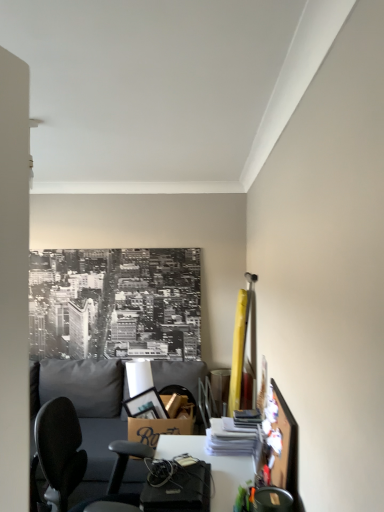
Question: Should I look upward or downward to see metallic gray chair at lower right?

Choices:
 (A) up
 (B) down

Answer: (B)

Question: From the image's perspective, is gray fabric couch at lower left located above white glossy desk at center?

Choices:
 (A) no
 (B) yes

Answer: (A)

Question: From the image's perspective, is gray fabric couch at lower left below white glossy desk at center?

Choices:
 (A) yes
 (B) no

Answer: (A)

Question: Considering the relative sizes of gray fabric couch at lower left and white glossy desk at center in the image provided, is gray fabric couch at lower left wider than white glossy desk at center?

Choices:
 (A) yes
 (B) no

Answer: (A)

Question: Does gray fabric couch at lower left appear on the left side of white glossy desk at center?

Choices:
 (A) yes
 (B) no

Answer: (A)

Question: Does gray fabric couch at lower left appear on the right side of white glossy desk at center?

Choices:
 (A) no
 (B) yes

Answer: (A)

Question: Is gray fabric couch at lower left not close to white glossy desk at center?

Choices:
 (A) yes
 (B) no

Answer: (B)

Question: Is white glossy desk at center facing towards gray fabric couch at lower left?

Choices:
 (A) yes
 (B) no

Answer: (B)

Question: Can you confirm if white glossy desk at center is shorter than gray fabric couch at lower left?

Choices:
 (A) no
 (B) yes

Answer: (B)

Question: Is white glossy desk at center not inside gray fabric couch at lower left?

Choices:
 (A) no
 (B) yes

Answer: (B)

Question: Can you confirm if white glossy desk at center is thinner than gray fabric couch at lower left?

Choices:
 (A) no
 (B) yes

Answer: (B)

Question: Can you confirm if white glossy desk at center is positioned to the left of gray fabric couch at lower left?

Choices:
 (A) no
 (B) yes

Answer: (A)

Question: Is white glossy desk at center closer to camera compared to gray fabric couch at lower left?

Choices:
 (A) no
 (B) yes

Answer: (B)

Question: Is gray fabric couch at lower left at the back of metallic gray chair at lower right?

Choices:
 (A) yes
 (B) no

Answer: (B)